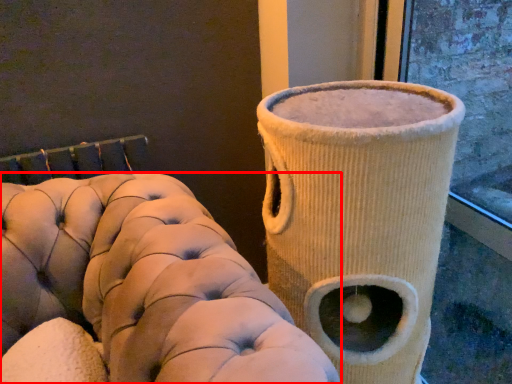
Question: Where is furniture (annotated by the red box) located in relation to vase in the image?

Choices:
 (A) right
 (B) left

Answer: (B)